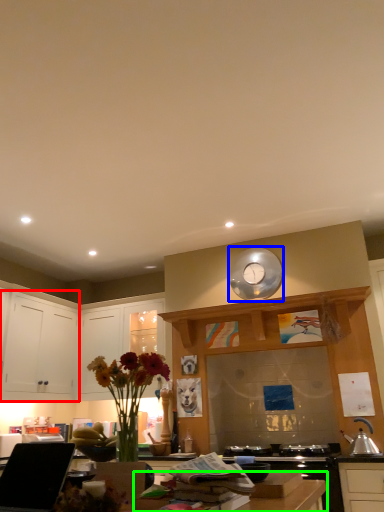
Question: Which object is the closest to the cabinetry (highlighted by a red box)? Choose among these: clock (highlighted by a blue box) or counter top (highlighted by a green box).

Choices:
 (A) clock
 (B) counter top

Answer: (A)